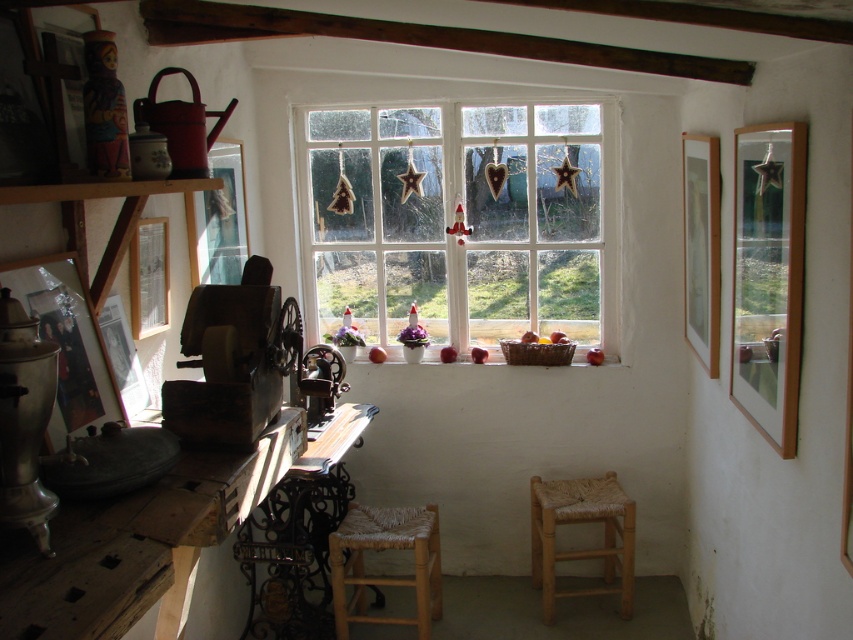
Which is more to the right, woven wood stool at lower center or wooden woven stool at center?

From the viewer's perspective, wooden woven stool at center appears more on the right side.

Between point (341, 520) and point (595, 480), which one is positioned in front?

Positioned in front is point (341, 520).

Is point (386, 520) farther from camera compared to point (621, 577)?

No, (386, 520) is closer to viewer.

At what (x,y) coordinates should I click in order to perform the action: click on woven wood stool at lower center. Please return your answer as a coordinate pair (x, y). Looking at the image, I should click on (386, 548).

Who is taller, white wooden window at center or metallic/brass-like chair at center?

With more height is white wooden window at center.

Can you confirm if white wooden window at center is shorter than metallic/brass-like chair at center?

In fact, white wooden window at center may be taller than metallic/brass-like chair at center.

Where is `white wooden window at center`? The height and width of the screenshot is (640, 853). white wooden window at center is located at coordinates (457, 220).

Who is higher up, wooden at left or metallic/brass-like chair at center?

Positioned higher is metallic/brass-like chair at center.

Is wooden at left thinner than metallic/brass-like chair at center?

Incorrect, wooden at left's width is not less than metallic/brass-like chair at center's.

Between point (115, 595) and point (326, 376), which one is positioned behind?

Point (326, 376)

The width and height of the screenshot is (853, 640). What are the coordinates of `wooden at left` in the screenshot? It's located at (144, 540).